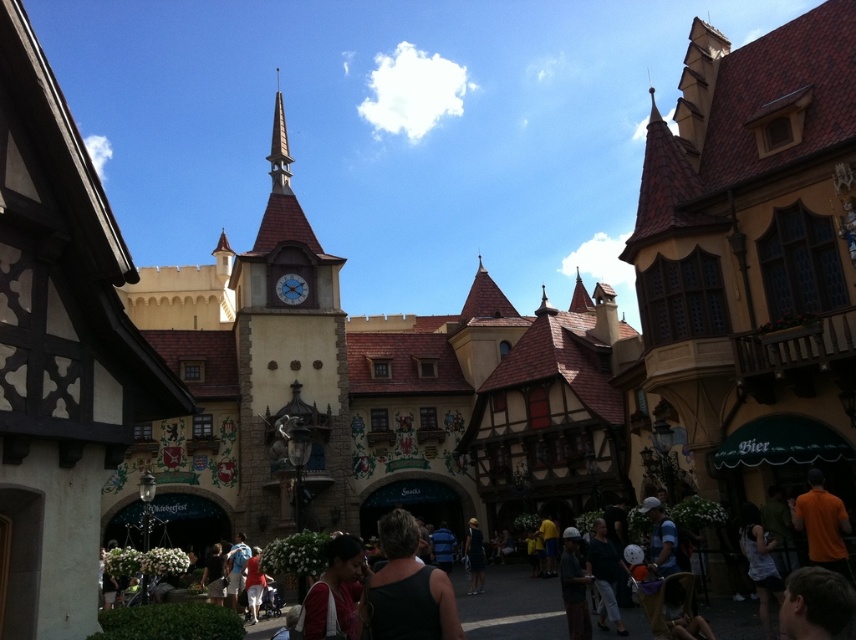
Question: Which point is farther from the camera taking this photo?

Choices:
 (A) (318, 634)
 (B) (468, 522)
 (C) (443, 604)

Answer: (B)

Question: Is matte pink dress at center closer to camera compared to blue glass clock at center?

Choices:
 (A) yes
 (B) no

Answer: (A)

Question: Can you confirm if matte stone clock tower at center is positioned to the left of black matte dress at center?

Choices:
 (A) yes
 (B) no

Answer: (A)

Question: Which of the following is the farthest from the observer?

Choices:
 (A) (379, 602)
 (B) (277, 182)

Answer: (B)

Question: Which point is closer to the camera?

Choices:
 (A) (467, 548)
 (B) (276, 131)

Answer: (A)

Question: Is black fabric at center further to the viewer compared to dark brown leather jacket at lower center?

Choices:
 (A) yes
 (B) no

Answer: (B)